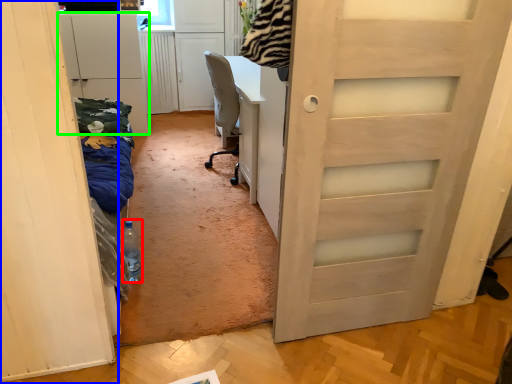
Question: Which is farther away from bottle (highlighted by a red box)? door (highlighted by a blue box) or cabinetry (highlighted by a green box)?

Choices:
 (A) door
 (B) cabinetry

Answer: (B)